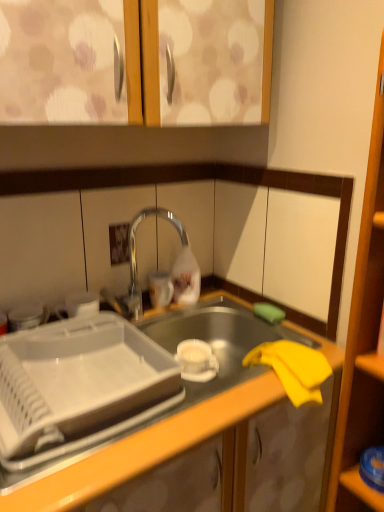
Question: Does transparent plastic shelf at lower right appear on the left side of matte wood cabinet doors at upper center?

Choices:
 (A) no
 (B) yes

Answer: (A)

Question: Is transparent plastic shelf at lower right taller than matte wood cabinet doors at upper center?

Choices:
 (A) yes
 (B) no

Answer: (B)

Question: Considering the relative sizes of transparent plastic shelf at lower right and matte wood cabinet doors at upper center in the image provided, is transparent plastic shelf at lower right thinner than matte wood cabinet doors at upper center?

Choices:
 (A) yes
 (B) no

Answer: (A)

Question: Is matte wood cabinet doors at upper center located within transparent plastic shelf at lower right?

Choices:
 (A) yes
 (B) no

Answer: (B)

Question: Is transparent plastic shelf at lower right turned away from matte wood cabinet doors at upper center?

Choices:
 (A) yes
 (B) no

Answer: (B)

Question: Is transparent plastic shelf at lower right smaller than matte wood cabinet doors at upper center?

Choices:
 (A) no
 (B) yes

Answer: (B)

Question: Does yellow fabric at lower right have a smaller size compared to polished chrome tap at center?

Choices:
 (A) yes
 (B) no

Answer: (B)

Question: From a real-world perspective, is yellow fabric at lower right below polished chrome tap at center?

Choices:
 (A) yes
 (B) no

Answer: (A)

Question: Is yellow fabric at lower right wider than polished chrome tap at center?

Choices:
 (A) no
 (B) yes

Answer: (B)

Question: Is the position of yellow fabric at lower right more distant than that of polished chrome tap at center?

Choices:
 (A) no
 (B) yes

Answer: (A)

Question: Could polished chrome tap at center be considered to be inside yellow fabric at lower right?

Choices:
 (A) yes
 (B) no

Answer: (B)

Question: Can you confirm if yellow fabric at lower right is taller than polished chrome tap at center?

Choices:
 (A) yes
 (B) no

Answer: (A)

Question: From a real-world perspective, is polished chrome tap at center on top of white plastic tray at center?

Choices:
 (A) no
 (B) yes

Answer: (B)